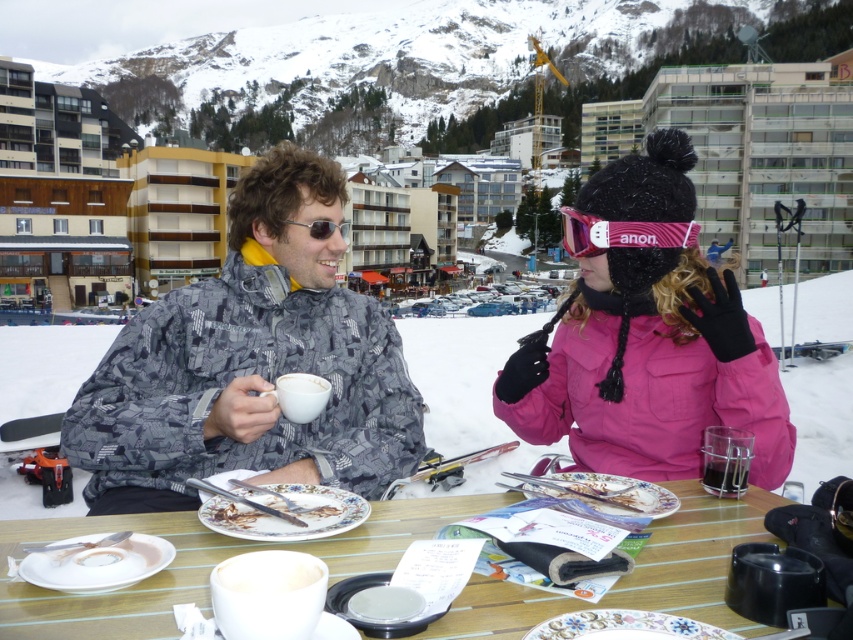
You are a GUI agent. You are given a task and a screenshot of the screen. Output one action in this format:
    pyautogui.click(x=<x>, y=<y>)
    Task: Click on the matte gray jacket at center
    The height and width of the screenshot is (640, 853).
    Given the screenshot: What is the action you would take?
    click(x=648, y=371)

Is matte gray jacket at center taller than clear plastic cup at lower center?

Yes, matte gray jacket at center is taller than clear plastic cup at lower center.

Is point (173, 332) positioned in front of point (741, 490)?

No, (173, 332) is behind (741, 490).

The width and height of the screenshot is (853, 640). Find the location of `matte gray jacket at center`. matte gray jacket at center is located at coordinates (648, 371).

Is point (299, 392) positioned in front of point (337, 225)?

Yes.

Does white matte cup at center have a larger size compared to sunglasses at center?

Incorrect, white matte cup at center is not larger than sunglasses at center.

Identify the location of white matte cup at center. point(300,384).

Is matte gray jacket at center to the left of pink matte goggles at upper center from the viewer's perspective?

Yes, matte gray jacket at center is to the left of pink matte goggles at upper center.

Who is positioned more to the right, matte gray jacket at center or pink matte goggles at upper center?

From the viewer's perspective, pink matte goggles at upper center appears more on the right side.

Locate an element on the screen. Image resolution: width=853 pixels, height=640 pixels. matte gray jacket at center is located at coordinates (648, 371).

Where is `matte gray jacket at center`? The height and width of the screenshot is (640, 853). matte gray jacket at center is located at coordinates (648, 371).